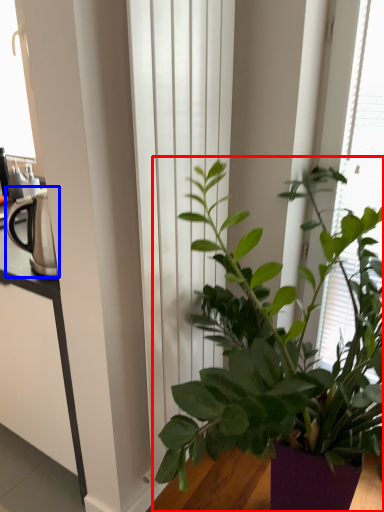
Question: Which point is further to the camera, houseplant (highlighted by a red box) or appliance (highlighted by a blue box)?

Choices:
 (A) houseplant
 (B) appliance

Answer: (B)